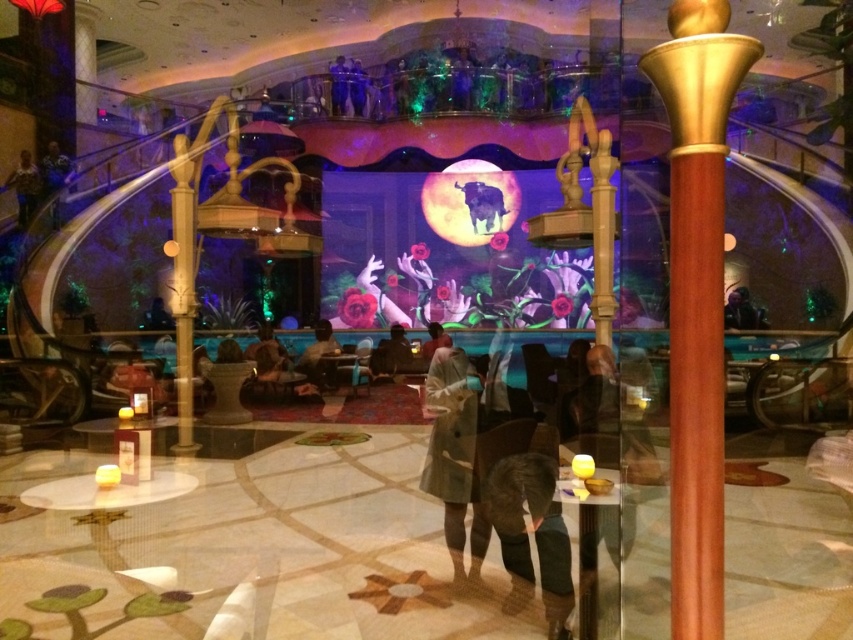
Is brown fuzzy coat at lower center in front of light brown leather jacket at center?

Yes, brown fuzzy coat at lower center is in front of light brown leather jacket at center.

Does brown fuzzy coat at lower center appear over light brown leather jacket at center?

No.

Identify the location of brown fuzzy coat at lower center. Image resolution: width=853 pixels, height=640 pixels. (531, 531).

Does brown fuzzy coat at lower center appear under light brown wool coat at center?

Yes, brown fuzzy coat at lower center is below light brown wool coat at center.

Which is in front, point (547, 492) or point (453, 449)?

Point (547, 492) is more forward.

Find the location of `brown fuzzy coat at lower center`. brown fuzzy coat at lower center is located at coordinates (531, 531).

Is point (498, 502) farther from camera compared to point (190, 376)?

No, it is in front of (190, 376).

Is brown fuzzy coat at lower center smaller than wooden column at center?

Indeed, brown fuzzy coat at lower center has a smaller size compared to wooden column at center.

Locate an element on the screen. The image size is (853, 640). brown fuzzy coat at lower center is located at coordinates (531, 531).

Find the location of `brown fuzzy coat at lower center`. brown fuzzy coat at lower center is located at coordinates (531, 531).